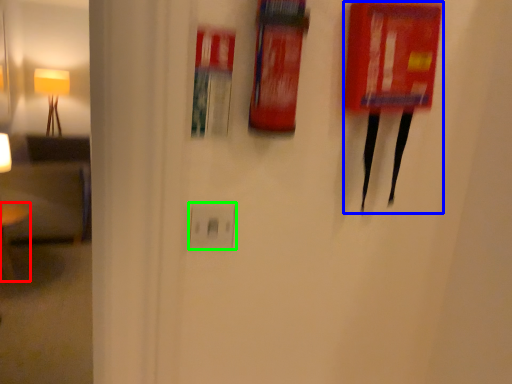
Question: Which object is positioned farthest from furniture (highlighted by a red box)? Select from wide (highlighted by a blue box) and electric outlet (highlighted by a green box).

Choices:
 (A) wide
 (B) electric outlet

Answer: (A)